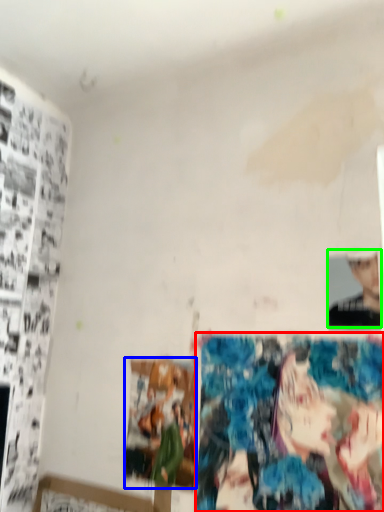
Question: Which is farther away from reflection (highlighted by a red box)? print (highlighted by a blue box) or person (highlighted by a green box)?

Choices:
 (A) print
 (B) person

Answer: (B)